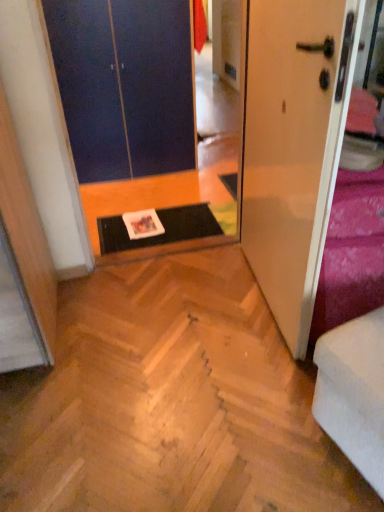
I want to click on vacant area that lies in front of blue matte door at upper left, the first door viewed from the left, so click(x=161, y=205).